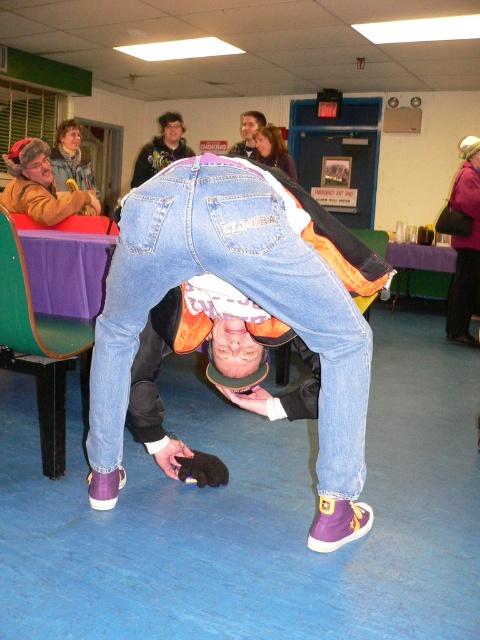
Based on the scene, which object is taller between the denim jeans at center and the dark brown hoodie at upper center?

The denim jeans at center is taller than the dark brown hoodie at upper center.

You are a photographer in the room and want to capture a photo of the denim jeans at center and dark brown hoodie at upper center. Which object should you focus on first if you want to ensure both are in the frame without moving the camera?

You should focus on the dark brown hoodie at upper center first because it is positioned above the denim jeans at center, so by centering the upper area, both objects will be included in the frame.

From the picture: You are a photographer trying to capture the person doing a handstand. You need to ensure that both the denim jeans at center and the dark brown hoodie at upper center are visible in the frame. Based on their positions, is there a risk that one might block the view of the other?

The denim jeans at center might be wider than dark brown hoodie at upper center, so there is a possibility that the denim jeans at center could block the view of the dark brown hoodie at upper center depending on the camera angle.